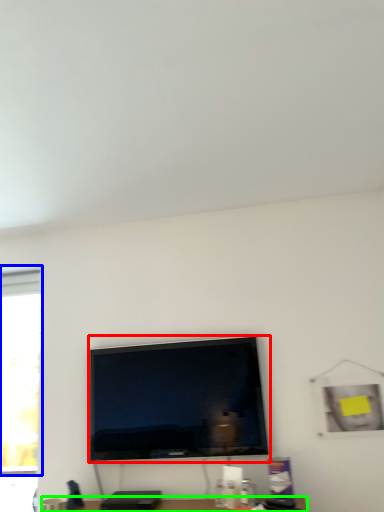
Question: Considering the real-world distances, which object is farthest from television (highlighted by a red box)? window (highlighted by a blue box) or furniture (highlighted by a green box)?

Choices:
 (A) window
 (B) furniture

Answer: (A)